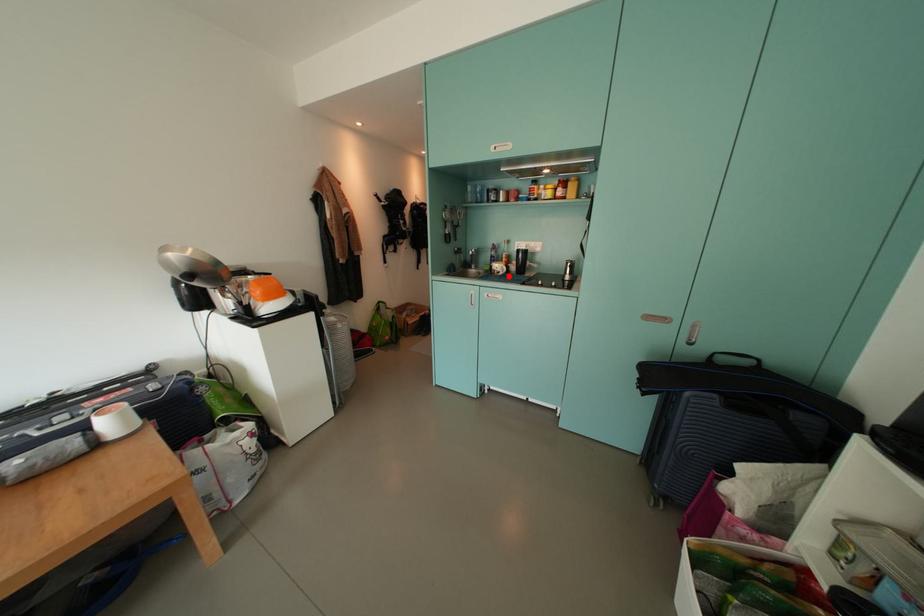
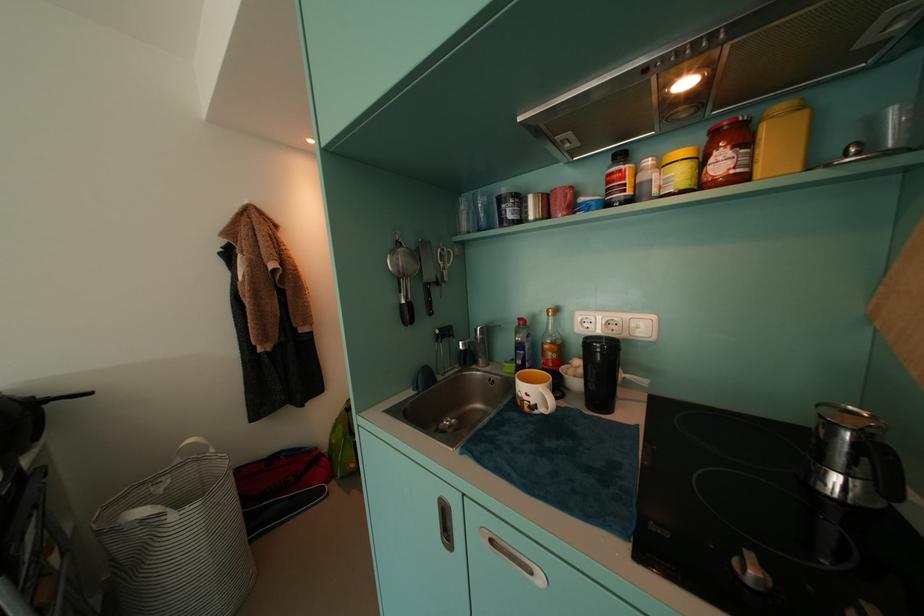
Question: I am providing you with two images of the same scene from different viewpoints. A red point is marked on the first image. Can you still see the location of the red point in image 2?

Choices:
 (A) Yes
 (B) No

Answer: (A)